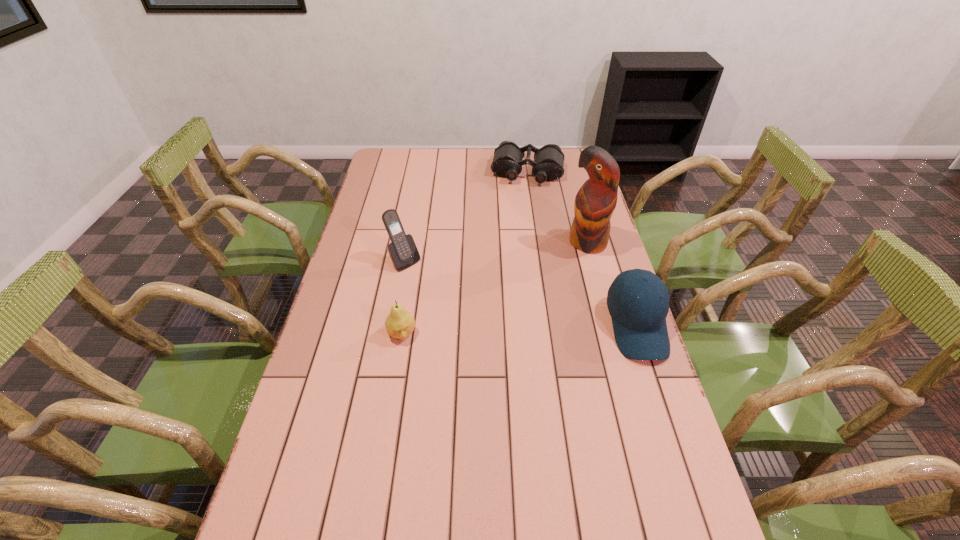
The image size is (960, 540). In order to click on vacant space on the desktop that is between the pear and the baseball cap and is positioned on the front-facing side of the fourth shortest object in this screenshot , I will do `click(485, 331)`.

Find the location of a particular element. free space on the desktop that is between the pear and the baseball cap and is positioned on the face of the tallest object is located at coordinates (509, 330).

Locate an element on the screen. The width and height of the screenshot is (960, 540). vacant space on the desktop that is between the pear and the baseball cap and is positioned through the eyepieces of the farthest object is located at coordinates (x=507, y=330).